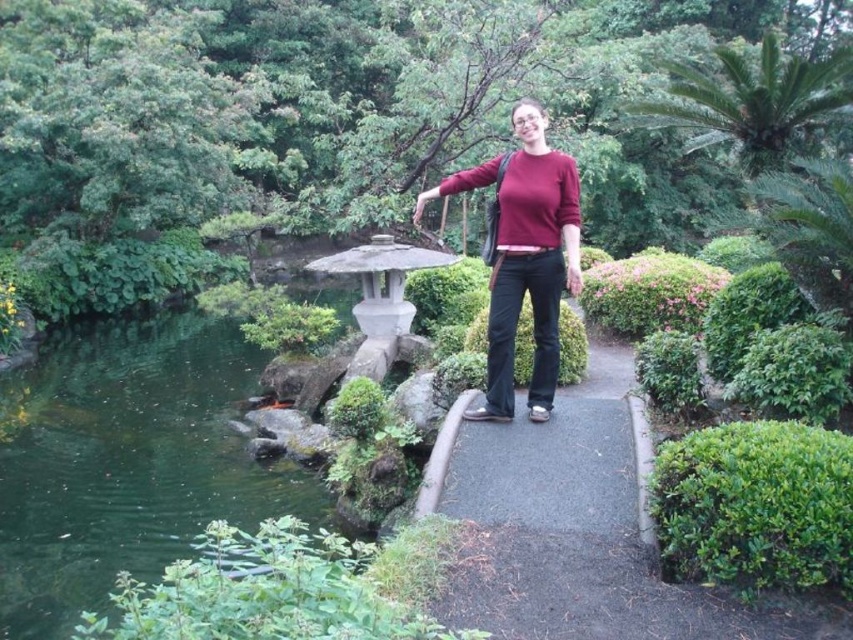
Can you confirm if green liquid water at lower left is bigger than matte red sweater at center?

Correct, green liquid water at lower left is larger in size than matte red sweater at center.

Which is behind, point (97, 442) or point (517, 225)?

The point (97, 442) is more distant.

You are a GUI agent. You are given a task and a screenshot of the screen. Output one action in this format:
    pyautogui.click(x=<x>, y=<y>)
    Task: Click on the green liquid water at lower left
    The image size is (853, 640).
    Given the screenshot: What is the action you would take?
    pyautogui.click(x=126, y=461)